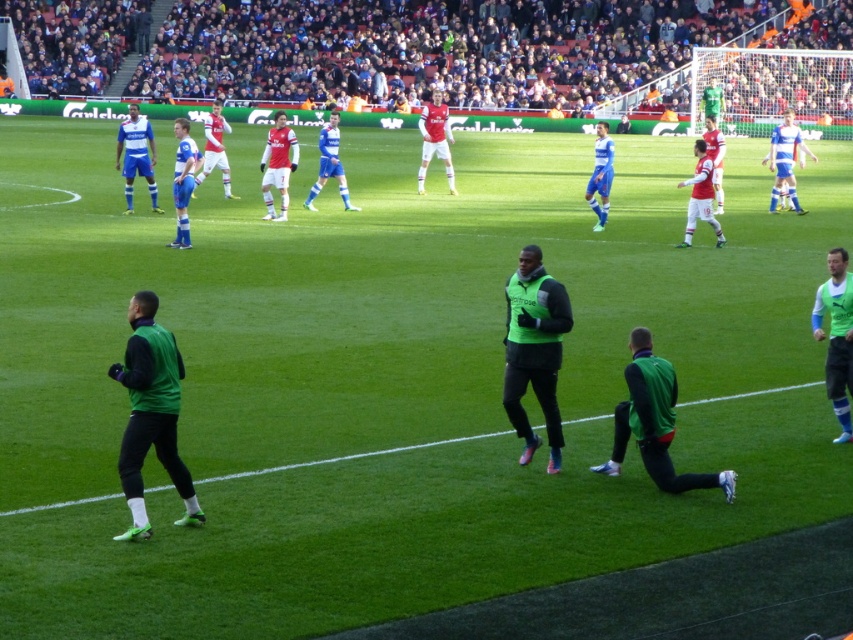
Question: Which object is farther from the camera taking this photo?

Choices:
 (A) blue matte jersey at center
 (B) white jersey at center
 (C) green matte vest at left
 (D) green matte jacket at center

Answer: (B)

Question: Which point is farther to the camera?

Choices:
 (A) (213, 136)
 (B) (555, 381)
 (C) (131, 106)
 (D) (422, 163)

Answer: (D)

Question: Which object is positioned closest to the green matte vest at right?

Choices:
 (A) blue matte jersey at center
 (B) green matte vest at left
 (C) matte blue shorts at center

Answer: (B)

Question: Does green matte vest at center have a larger size compared to blue matte jersey at center?

Choices:
 (A) no
 (B) yes

Answer: (B)

Question: Does green matte vest at center appear on the right side of matte blue shorts at center?

Choices:
 (A) no
 (B) yes

Answer: (B)

Question: Does green matte vest at left have a larger size compared to green matte vest at right?

Choices:
 (A) yes
 (B) no

Answer: (A)